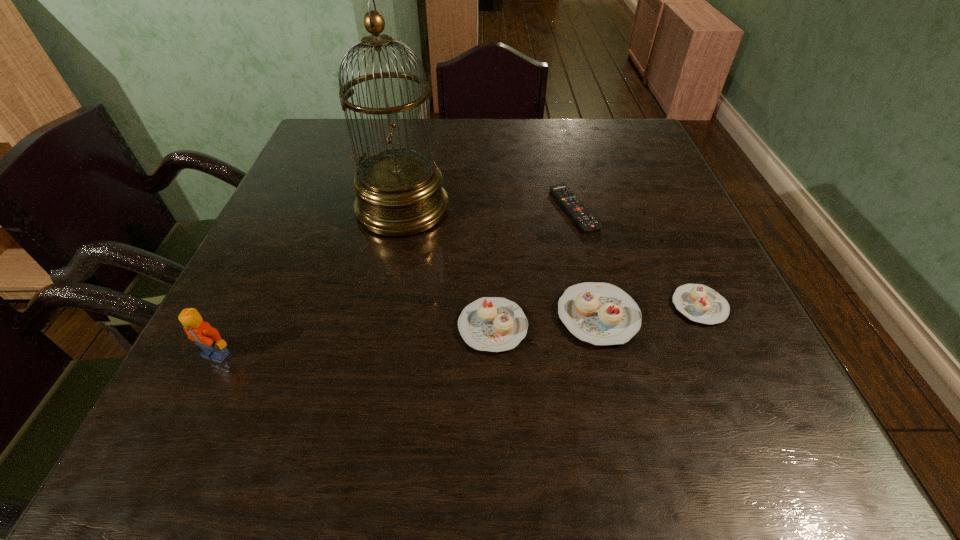
Where is `remote control`? This screenshot has width=960, height=540. remote control is located at coordinates (582, 216).

Locate an element on the screen. vacant region located on the back of the leftmost cupcake is located at coordinates (490, 197).

Identify the location of vacant space situated on the left of the fourth shortest object. The height and width of the screenshot is (540, 960). (371, 316).

Identify the location of free spot located 0.160m on the left of the rightmost cupcake. The width and height of the screenshot is (960, 540). (586, 306).

This screenshot has height=540, width=960. I want to click on free space located 0.150m with an open door on the fifth object from right to left, so click(514, 208).

This screenshot has width=960, height=540. Identify the location of free space located 0.150m on the left of the shortest object. tap(488, 209).

Locate an element on the screen. The image size is (960, 540). cupcake that is at the near edge is located at coordinates (494, 324).

Where is `Lego positioned at the near edge`? Lego positioned at the near edge is located at coordinates coord(200,332).

At what (x,y) coordinates should I click in order to perform the action: click on object that is positioned at the left edge. Please return your answer as a coordinate pair (x, y). The width and height of the screenshot is (960, 540). Looking at the image, I should click on (200, 332).

This screenshot has height=540, width=960. Find the location of `object at the right edge`. object at the right edge is located at coordinates (699, 303).